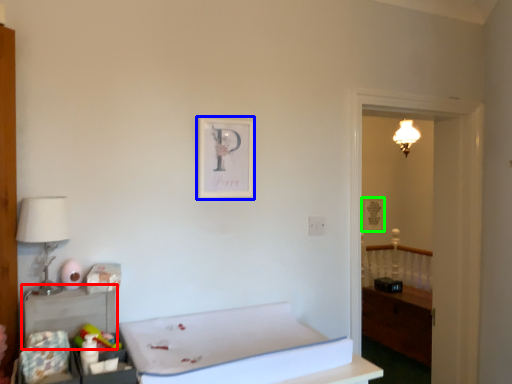
Question: Which object is positioned farthest from table (highlighted by a red box)? Select from picture frame (highlighted by a blue box) and picture frame (highlighted by a green box).

Choices:
 (A) picture frame
 (B) picture frame

Answer: (B)